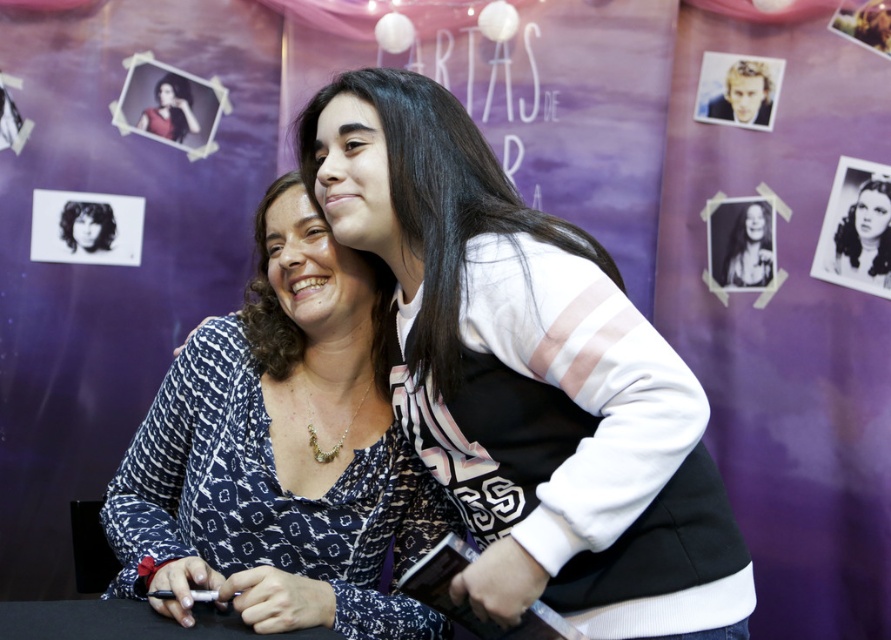
You are a photographer at the event and want to ensure both the white matte sweater at center and the patterned fabric blouse at center are clearly visible in your photo. Which clothing item should you focus on first to ensure it doesn t get cropped out if the frame is tight?

The white matte sweater at center has a smaller size compared to the patterned fabric blouse at center, so you should focus on ensuring the smaller white matte sweater at center is fully visible first to prevent it from being cropped out when the frame is tight.

From the picture: You are an event organizer who needs to ensure that all items on the stage are visible to the audience. You notice the white matte sweater at center and the black glossy photo at center. Which item is taller and might block the view of the other?

The white matte sweater at center has a greater height compared to the black glossy photo at center, so it is taller and might block the view of the other.